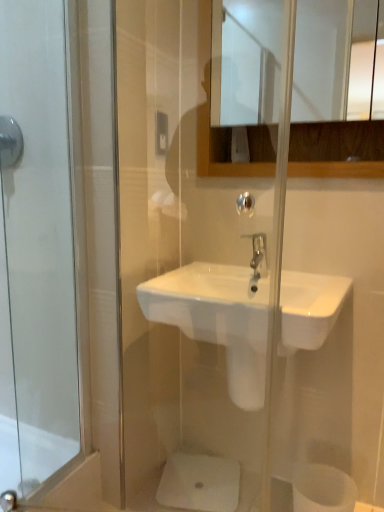
Question: From a real-world perspective, does brushed metal shower at upper left stand above white matte toilet paper at lower right?

Choices:
 (A) no
 (B) yes

Answer: (B)

Question: Considering the relative sizes of brushed metal shower at upper left and white matte toilet paper at lower right in the image provided, is brushed metal shower at upper left thinner than white matte toilet paper at lower right?

Choices:
 (A) no
 (B) yes

Answer: (B)

Question: Does brushed metal shower at upper left appear on the right side of white matte toilet paper at lower right?

Choices:
 (A) no
 (B) yes

Answer: (A)

Question: Is brushed metal shower at upper left positioned in front of white matte toilet paper at lower right?

Choices:
 (A) no
 (B) yes

Answer: (A)

Question: Considering the relative positions of brushed metal shower at upper left and white matte toilet paper at lower right in the image provided, is brushed metal shower at upper left behind white matte toilet paper at lower right?

Choices:
 (A) yes
 (B) no

Answer: (A)

Question: From a real-world perspective, is brushed metal shower at upper left positioned above or below polished chrome faucet at center?

Choices:
 (A) below
 (B) above

Answer: (B)

Question: Considering the positions of brushed metal shower at upper left and polished chrome faucet at center in the image, is brushed metal shower at upper left taller or shorter than polished chrome faucet at center?

Choices:
 (A) short
 (B) tall

Answer: (B)

Question: Do you think brushed metal shower at upper left is within polished chrome faucet at center, or outside of it?

Choices:
 (A) outside
 (B) inside

Answer: (A)

Question: Considering the positions of brushed metal shower at upper left and polished chrome faucet at center in the image, is brushed metal shower at upper left wider or thinner than polished chrome faucet at center?

Choices:
 (A) thin
 (B) wide

Answer: (A)

Question: Considering the positions of brushed metal shower at upper left and glossy wooden mirror at upper center in the image, is brushed metal shower at upper left taller or shorter than glossy wooden mirror at upper center?

Choices:
 (A) short
 (B) tall

Answer: (A)

Question: Would you say brushed metal shower at upper left is to the left or to the right of glossy wooden mirror at upper center in the picture?

Choices:
 (A) right
 (B) left

Answer: (B)

Question: Is brushed metal shower at upper left spatially inside glossy wooden mirror at upper center, or outside of it?

Choices:
 (A) inside
 (B) outside

Answer: (B)

Question: From a real-world perspective, is brushed metal shower at upper left positioned above or below glossy wooden mirror at upper center?

Choices:
 (A) below
 (B) above

Answer: (A)

Question: Considering their positions, is brushed metal shower at upper left located in front of or behind white matte toilet paper at lower right?

Choices:
 (A) behind
 (B) front

Answer: (A)

Question: Would you say brushed metal shower at upper left is to the left or to the right of white matte toilet paper at lower right in the picture?

Choices:
 (A) right
 (B) left

Answer: (B)